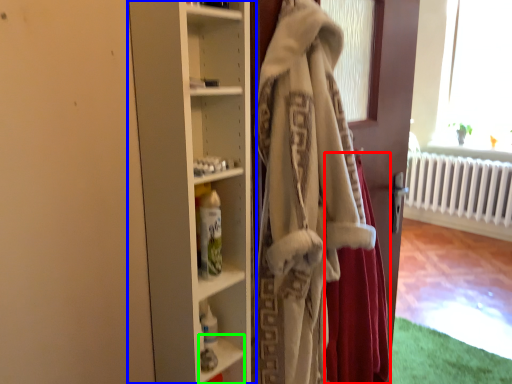
Question: Based on their relative distances, which object is nearer to shawl (highlighted by a red box)? Choose from cupboard (highlighted by a blue box) and shelf (highlighted by a green box).

Choices:
 (A) cupboard
 (B) shelf

Answer: (B)